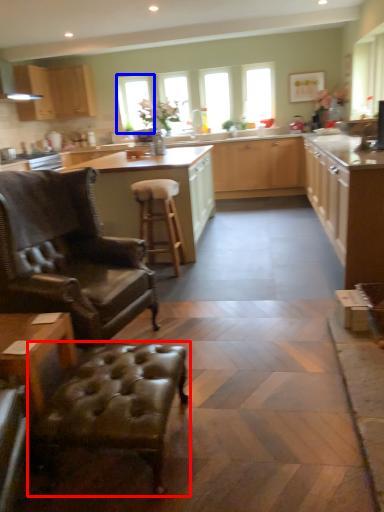
Question: Which object is further to the camera taking this photo, swivel chair (highlighted by a red box) or window (highlighted by a blue box)?

Choices:
 (A) swivel chair
 (B) window

Answer: (B)